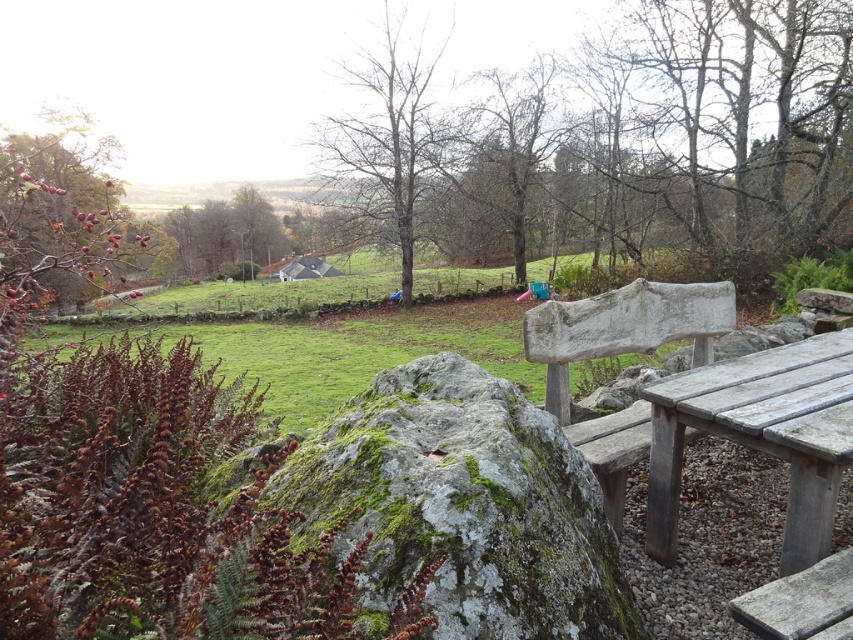
Question: Which point is closer to the camera taking this photo?

Choices:
 (A) (822, 365)
 (B) (763, 624)
 (C) (526, 582)

Answer: (C)

Question: Does green mossy rock at center have a larger size compared to weathered wood picnic table at lower right?

Choices:
 (A) no
 (B) yes

Answer: (A)

Question: Among these points, which one is nearest to the camera?

Choices:
 (A) (534, 392)
 (B) (358, 419)
 (C) (590, 344)

Answer: (B)

Question: Can you confirm if bare wood tree at center is positioned to the left of gray weathered wood bench at lower right?

Choices:
 (A) no
 (B) yes

Answer: (B)

Question: Can you confirm if green mossy rock at center is wider than weathered wood picnic table at lower right?

Choices:
 (A) no
 (B) yes

Answer: (A)

Question: Which of the following is the farthest from the observer?

Choices:
 (A) green grassy field at center
 (B) weathered wood bench at center-right

Answer: (A)